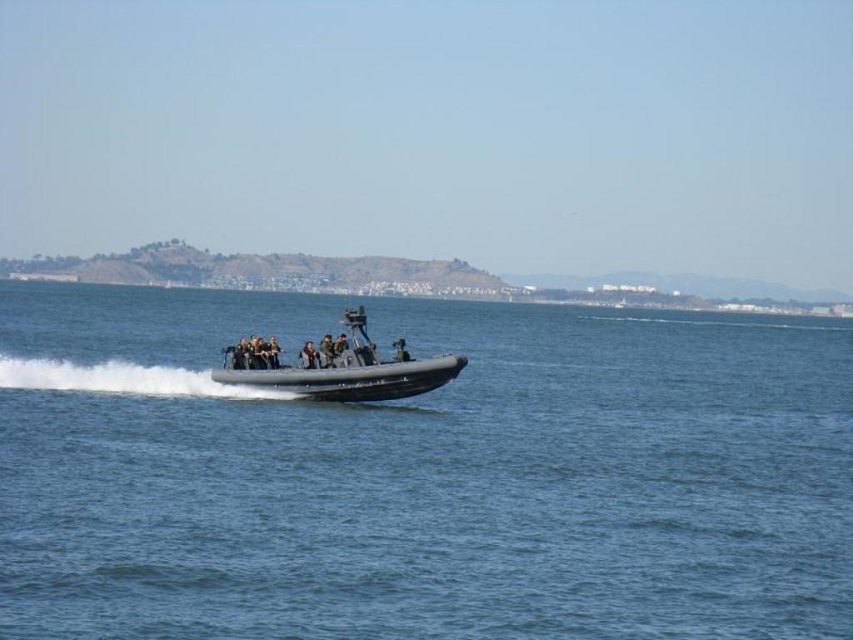
Based on the photo, who is lower down, clear blue water at center or black matte uniform at center?

black matte uniform at center

Between point (225, 436) and point (306, 364), which one is positioned in front?

Point (225, 436) is in front.

What do you see at coordinates (421, 474) in the screenshot? I see `clear blue water at center` at bounding box center [421, 474].

Locate an element on the screen. The height and width of the screenshot is (640, 853). clear blue water at center is located at coordinates (421, 474).

Does dark gray rubber boat at center appear over black matte uniform at center?

Yes, dark gray rubber boat at center is above black matte uniform at center.

Does dark gray rubber boat at center have a greater height compared to black matte uniform at center?

Correct, dark gray rubber boat at center is much taller as black matte uniform at center.

What are the coordinates of `dark gray rubber boat at center` in the screenshot? It's located at (340, 369).

Who is more forward, (289,586) or (315,394)?

Point (289,586) is more forward.

Does clear blue water at center have a greater height compared to dark gray rubber boat at center?

Yes, clear blue water at center is taller than dark gray rubber boat at center.

Looking at this image, who is more forward, [173,579] or [451,355]?

Point [173,579] is more forward.

Locate an element on the screen. The image size is (853, 640). clear blue water at center is located at coordinates (421, 474).